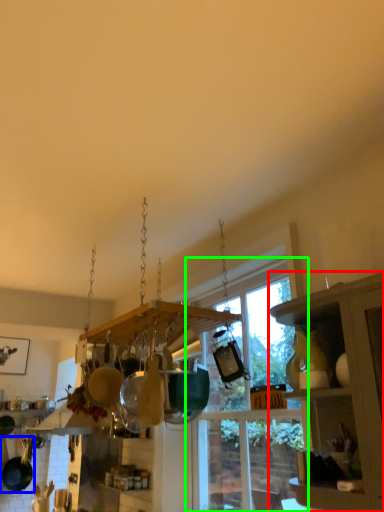
Question: Estimate the real-world distances between objects in this image. Which object is closer to cabinetry (highlighted by a red box), frying pan (highlighted by a blue box) or window (highlighted by a green box)?

Choices:
 (A) frying pan
 (B) window

Answer: (B)